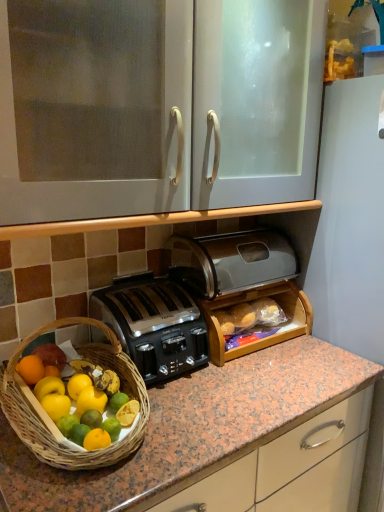
Image resolution: width=384 pixels, height=512 pixels. Describe the element at coordinates (251, 303) in the screenshot. I see `wooden bread box at center, acting as the first cabinetry starting from the bottom` at that location.

How much space does wooden bread box at center, which is the second cabinetry in top-to-bottom order, occupy vertically?

It is 7.86 inches.

At what (x,y) coordinates should I click in order to perform the action: click on satin black toaster at center, the 1th toaster ordered from the bottom. Please return your answer as a coordinate pair (x, y). Looking at the image, I should click on (153, 324).

In order to face satin black toaster at center, placed as the second toaster when sorted from top to bottom, should I rotate leftwards or rightwards?

To align with it, rotate left about 5.544°.

Where is `satin black toaster at center, arranged as the second toaster when ordered from the bottom`? The width and height of the screenshot is (384, 512). satin black toaster at center, arranged as the second toaster when ordered from the bottom is located at coordinates (231, 261).

The width and height of the screenshot is (384, 512). In order to click on wooden bread box at center, which is the second cabinetry in top-to-bottom order in this screenshot , I will do `click(251, 303)`.

Can you tell me how much white glossy cabinet at upper center, the second cabinetry ordered from the bottom, and satin black toaster at center, arranged as the first toaster when viewed from the top, differ in facing direction?

They differ by 0.000823 degrees in their facing directions.

Looking at this image, can you confirm if white glossy cabinet at upper center, which ranks as the 1th cabinetry in top-to-bottom order, is thinner than satin black toaster at center, arranged as the first toaster when viewed from the top?

Incorrect, the width of white glossy cabinet at upper center, which ranks as the 1th cabinetry in top-to-bottom order, is not less than that of satin black toaster at center, arranged as the first toaster when viewed from the top.

Does point (142, 35) lie behind point (276, 273)?

That is False.

Is white glossy cabinet at upper center, which ranks as the 1th cabinetry in top-to-bottom order, oriented away from satin black toaster at center, arranged as the first toaster when viewed from the top?

white glossy cabinet at upper center, which ranks as the 1th cabinetry in top-to-bottom order, is not turned away from satin black toaster at center, arranged as the first toaster when viewed from the top.

Is wooden bread box at center, acting as the first cabinetry starting from the bottom, aimed at satin black toaster at center, arranged as the first toaster when viewed from the top?

No, wooden bread box at center, acting as the first cabinetry starting from the bottom, is not oriented towards satin black toaster at center, arranged as the first toaster when viewed from the top.

Which object is further away from the camera, wooden bread box at center, acting as the first cabinetry starting from the bottom, or satin black toaster at center, arranged as the first toaster when viewed from the top?

wooden bread box at center, acting as the first cabinetry starting from the bottom, is further from the camera.

Are wooden bread box at center, which is the second cabinetry in top-to-bottom order, and satin black toaster at center, arranged as the second toaster when ordered from the bottom, beside each other?

No, wooden bread box at center, which is the second cabinetry in top-to-bottom order, is not beside satin black toaster at center, arranged as the second toaster when ordered from the bottom.

From the image's perspective, which is above, wooden bread box at center, acting as the first cabinetry starting from the bottom, or satin black toaster at center, arranged as the first toaster when viewed from the top?

satin black toaster at center, arranged as the first toaster when viewed from the top, appears higher in the image.

From the image's perspective, is satin black toaster at center, the 1th toaster ordered from the bottom, located beneath satin black toaster at center, arranged as the second toaster when ordered from the bottom?

Correct, satin black toaster at center, the 1th toaster ordered from the bottom, appears lower than satin black toaster at center, arranged as the second toaster when ordered from the bottom, in the image.

Is satin black toaster at center, placed as the second toaster when sorted from top to bottom, far from satin black toaster at center, arranged as the second toaster when ordered from the bottom?

satin black toaster at center, placed as the second toaster when sorted from top to bottom, is actually quite close to satin black toaster at center, arranged as the second toaster when ordered from the bottom.

Considering the sizes of objects satin black toaster at center, placed as the second toaster when sorted from top to bottom, and satin black toaster at center, arranged as the second toaster when ordered from the bottom, in the image provided, who is thinner, satin black toaster at center, placed as the second toaster when sorted from top to bottom, or satin black toaster at center, arranged as the second toaster when ordered from the bottom,?

satin black toaster at center, arranged as the second toaster when ordered from the bottom, is thinner.

Is point (225, 307) closer or farther from the camera than point (148, 346)?

Point (225, 307) is positioned farther from the camera compared to point (148, 346).

What's the angular difference between wooden bread box at center, which is the second cabinetry in top-to-bottom order, and satin black toaster at center, placed as the second toaster when sorted from top to bottom,'s facing directions?

0.513 degrees.

At what (x,y) coordinates should I click in order to perform the action: click on the 2nd cabinetry to the right of the satin black toaster at center, the 1th toaster ordered from the bottom, counting from the anchor's position. Please return your answer as a coordinate pair (x, y). This screenshot has height=512, width=384. Looking at the image, I should click on (251, 303).

From the image's perspective, which one is positioned higher, wooden bread box at center, acting as the first cabinetry starting from the bottom, or satin black toaster at center, placed as the second toaster when sorted from top to bottom?

wooden bread box at center, acting as the first cabinetry starting from the bottom, appears higher in the image.

Between point (280, 285) and point (188, 61), which one is positioned in front?

Positioned in front is point (188, 61).

In the image, is wooden bread box at center, acting as the first cabinetry starting from the bottom, positioned in front of or behind white glossy cabinet at upper center, which ranks as the 1th cabinetry in top-to-bottom order?

In the image, wooden bread box at center, acting as the first cabinetry starting from the bottom, appears behind white glossy cabinet at upper center, which ranks as the 1th cabinetry in top-to-bottom order.

In the scene shown: From the image's perspective, is wooden bread box at center, which is the second cabinetry in top-to-bottom order, on top of white glossy cabinet at upper center, the second cabinetry ordered from the bottom?

Incorrect, from the image's perspective, wooden bread box at center, which is the second cabinetry in top-to-bottom order, is lower than white glossy cabinet at upper center, the second cabinetry ordered from the bottom.

From the picture: Based on their sizes in the image, would you say satin black toaster at center, the 1th toaster ordered from the bottom, is bigger or smaller than wooden bread box at center, which is the second cabinetry in top-to-bottom order?

Considering their sizes, satin black toaster at center, the 1th toaster ordered from the bottom, takes up less space than wooden bread box at center, which is the second cabinetry in top-to-bottom order.

Which object is positioned more to the right, satin black toaster at center, placed as the second toaster when sorted from top to bottom, or wooden bread box at center, which is the second cabinetry in top-to-bottom order?

wooden bread box at center, which is the second cabinetry in top-to-bottom order, is more to the right.

From a real-world perspective, is satin black toaster at center, the 1th toaster ordered from the bottom, on wooden bread box at center, which is the second cabinetry in top-to-bottom order?

Yes, from a real-world perspective, satin black toaster at center, the 1th toaster ordered from the bottom, is over wooden bread box at center, which is the second cabinetry in top-to-bottom order

Which is more to the left, satin black toaster at center, arranged as the second toaster when ordered from the bottom, or satin black toaster at center, the 1th toaster ordered from the bottom?

Positioned to the left is satin black toaster at center, the 1th toaster ordered from the bottom.

Considering the positions of objects satin black toaster at center, arranged as the first toaster when viewed from the top, and satin black toaster at center, the 1th toaster ordered from the bottom, in the image provided, who is in front, satin black toaster at center, arranged as the first toaster when viewed from the top, or satin black toaster at center, the 1th toaster ordered from the bottom,?

satin black toaster at center, the 1th toaster ordered from the bottom, is more forward.

Between satin black toaster at center, arranged as the second toaster when ordered from the bottom, and satin black toaster at center, placed as the second toaster when sorted from top to bottom, which one has smaller width?

satin black toaster at center, arranged as the second toaster when ordered from the bottom, is thinner.

Is point (190, 247) positioned behind point (200, 344)?

That is True.

Find the location of `cabinetry above the satin black toaster at center, arranged as the second toaster when ordered from the bottom (from a real-world perspective)`. cabinetry above the satin black toaster at center, arranged as the second toaster when ordered from the bottom (from a real-world perspective) is located at coordinates (157, 106).

From the wooden bread box at center, which is the second cabinetry in top-to-bottom order, count 1st toasters forward and point to it. Please provide its 2D coordinates.

[(231, 261)]

When comparing their distances from satin black toaster at center, arranged as the first toaster when viewed from the top, does satin black toaster at center, the 1th toaster ordered from the bottom, or wooden bread box at center, which is the second cabinetry in top-to-bottom order, seem further?

satin black toaster at center, the 1th toaster ordered from the bottom.

Based on their spatial positions, is wooden bread box at center, acting as the first cabinetry starting from the bottom, or white glossy cabinet at upper center, the second cabinetry ordered from the bottom, closer to satin black toaster at center, arranged as the second toaster when ordered from the bottom?

Based on the image, wooden bread box at center, acting as the first cabinetry starting from the bottom, appears to be nearer to satin black toaster at center, arranged as the second toaster when ordered from the bottom.

Looking at this image, from the image, which object appears to be farther from satin black toaster at center, the 1th toaster ordered from the bottom, satin black toaster at center, arranged as the second toaster when ordered from the bottom, or wooden bread box at center, which is the second cabinetry in top-to-bottom order?

Among the two, satin black toaster at center, arranged as the second toaster when ordered from the bottom, is located further to satin black toaster at center, the 1th toaster ordered from the bottom.

Considering their positions, is white glossy cabinet at upper center, the second cabinetry ordered from the bottom, positioned closer to satin black toaster at center, the 1th toaster ordered from the bottom, than satin black toaster at center, arranged as the second toaster when ordered from the bottom?

Based on the image, satin black toaster at center, arranged as the second toaster when ordered from the bottom, appears to be nearer to satin black toaster at center, the 1th toaster ordered from the bottom.

Which object lies nearer to the anchor point wooden bread box at center, acting as the first cabinetry starting from the bottom, satin black toaster at center, placed as the second toaster when sorted from top to bottom, or white glossy cabinet at upper center, the second cabinetry ordered from the bottom?

satin black toaster at center, placed as the second toaster when sorted from top to bottom, is positioned closer to the anchor wooden bread box at center, acting as the first cabinetry starting from the bottom.

Looking at the image, which one is located further to satin black toaster at center, arranged as the second toaster when ordered from the bottom, white glossy cabinet at upper center, which ranks as the 1th cabinetry in top-to-bottom order, or satin black toaster at center, placed as the second toaster when sorted from top to bottom?

white glossy cabinet at upper center, which ranks as the 1th cabinetry in top-to-bottom order, is positioned further to the anchor satin black toaster at center, arranged as the second toaster when ordered from the bottom.

Estimate the real-world distances between objects in this image. Which object is further from white glossy cabinet at upper center, the second cabinetry ordered from the bottom, satin black toaster at center, placed as the second toaster when sorted from top to bottom, or satin black toaster at center, arranged as the first toaster when viewed from the top?

satin black toaster at center, placed as the second toaster when sorted from top to bottom, is further to white glossy cabinet at upper center, the second cabinetry ordered from the bottom.

Estimate the real-world distances between objects in this image. Which object is further from wooden bread box at center, acting as the first cabinetry starting from the bottom, satin black toaster at center, the 1th toaster ordered from the bottom, or satin black toaster at center, arranged as the first toaster when viewed from the top?

The object further to wooden bread box at center, acting as the first cabinetry starting from the bottom, is satin black toaster at center, the 1th toaster ordered from the bottom.

Where is `cabinetry between white glossy cabinet at upper center, which ranks as the 1th cabinetry in top-to-bottom order, and satin black toaster at center, placed as the second toaster when sorted from top to bottom, from top to bottom`? Image resolution: width=384 pixels, height=512 pixels. cabinetry between white glossy cabinet at upper center, which ranks as the 1th cabinetry in top-to-bottom order, and satin black toaster at center, placed as the second toaster when sorted from top to bottom, from top to bottom is located at coordinates (251, 303).

Locate an element on the screen. This screenshot has width=384, height=512. toaster between white glossy cabinet at upper center, which ranks as the 1th cabinetry in top-to-bottom order, and satin black toaster at center, placed as the second toaster when sorted from top to bottom, in the vertical direction is located at coordinates (231, 261).

In order to click on toaster situated between satin black toaster at center, the 1th toaster ordered from the bottom, and wooden bread box at center, which is the second cabinetry in top-to-bottom order, from left to right in this screenshot , I will do point(231,261).